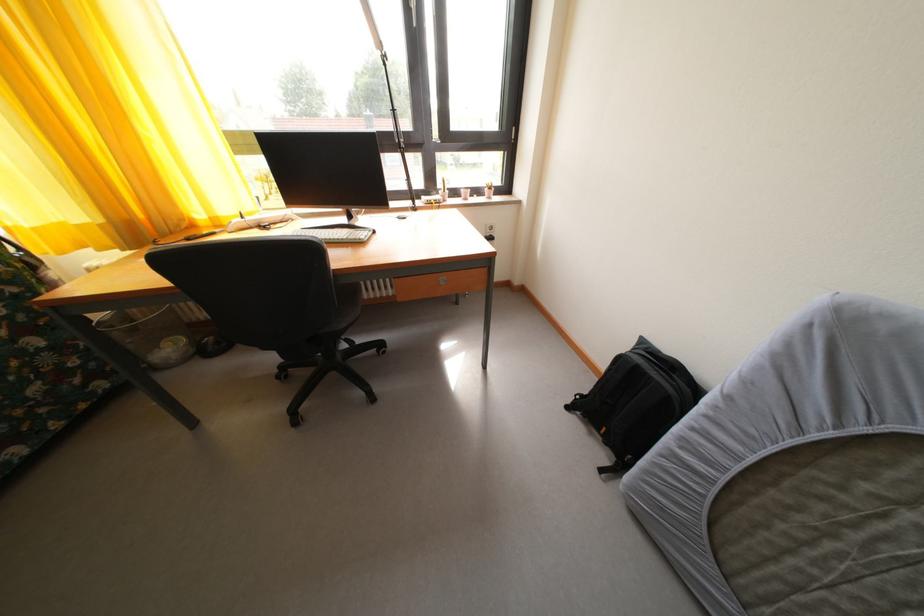
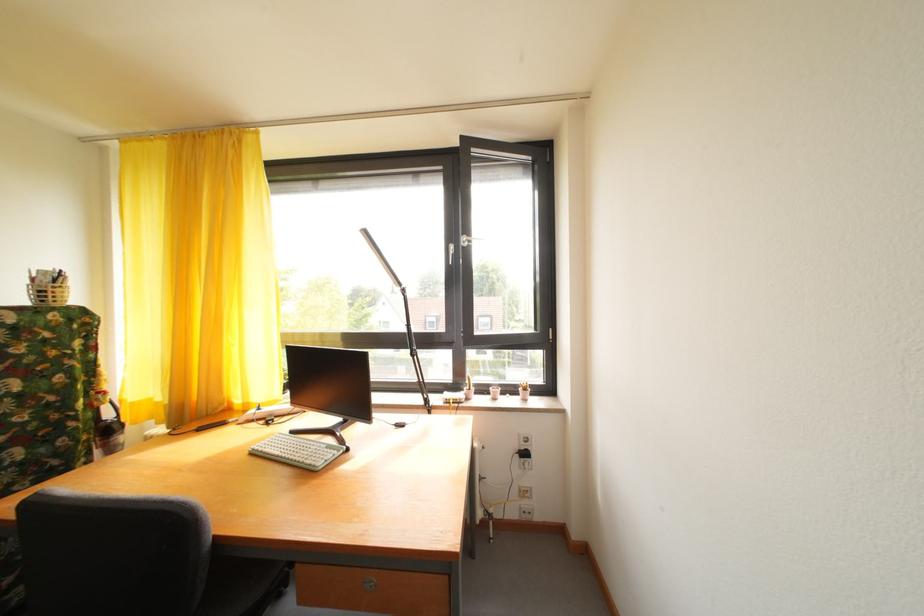
The images are taken continuously from a first-person perspective. In which direction is your viewpoint rotating?

The camera's rotation is toward left-up.